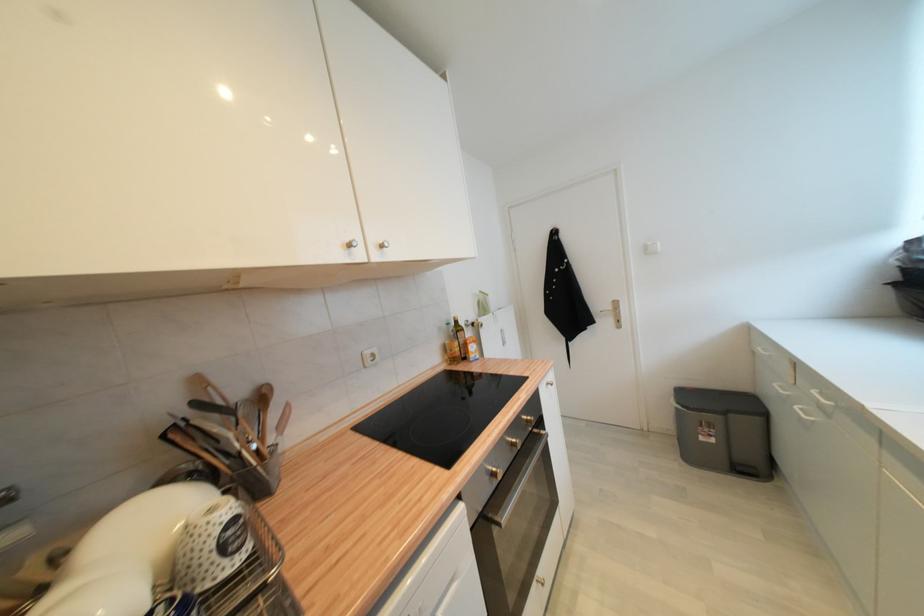
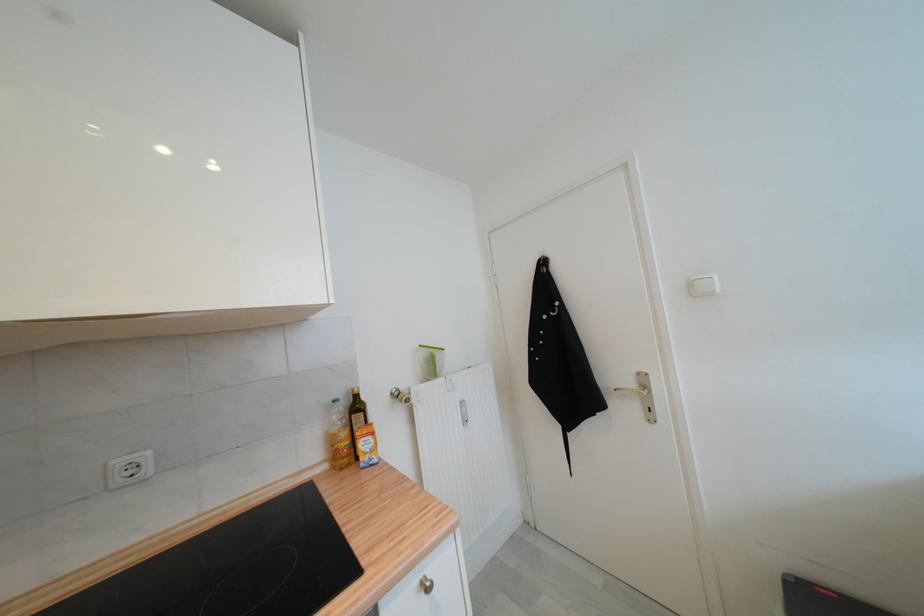
Where in the second image is the point corresponding to (x=614, y=310) from the first image?

(637, 386)